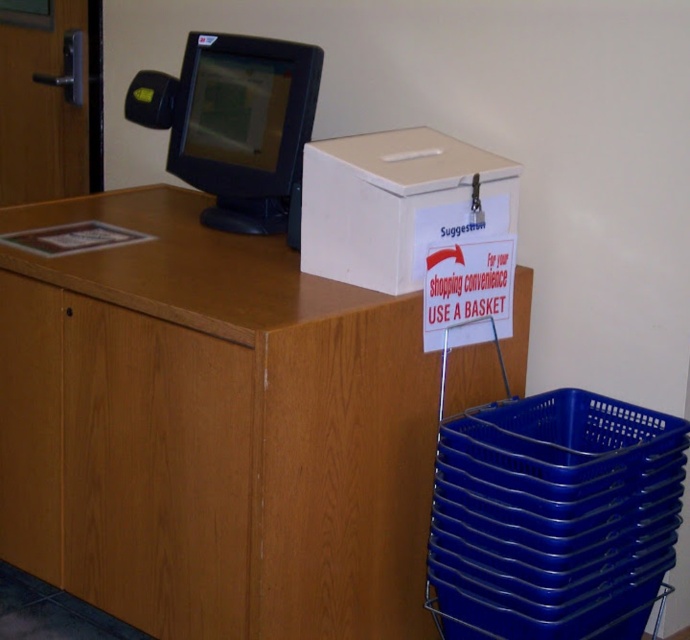
Does wooden table at center have a smaller size compared to matte black monitor at upper center?

No, wooden table at center is not smaller than matte black monitor at upper center.

Describe the element at coordinates (213, 429) in the screenshot. I see `wooden table at center` at that location.

Is point (313, 452) behind point (277, 209)?

No, it is in front of (277, 209).

Locate an element on the screen. This screenshot has height=640, width=690. wooden table at center is located at coordinates (213, 429).

Can you confirm if blue plastic basket at lower right is positioned to the left of white plastic box at upper center?

In fact, blue plastic basket at lower right is to the right of white plastic box at upper center.

Which of these two, blue plastic basket at lower right or white plastic box at upper center, stands shorter?

white plastic box at upper center is shorter.

Does point (631, 476) come farther from viewer compared to point (393, 236)?

No.

The height and width of the screenshot is (640, 690). I want to click on blue plastic basket at lower right, so click(x=553, y=516).

This screenshot has height=640, width=690. What do you see at coordinates (213, 429) in the screenshot?
I see `wooden table at center` at bounding box center [213, 429].

Consider the image. Does wooden table at center have a larger size compared to blue plastic basket at lower right?

Yes.

Describe the element at coordinates (213, 429) in the screenshot. This screenshot has width=690, height=640. I see `wooden table at center` at that location.

At what (x,y) coordinates should I click in order to perform the action: click on wooden table at center. Please return your answer as a coordinate pair (x, y). This screenshot has height=640, width=690. Looking at the image, I should click on point(213,429).